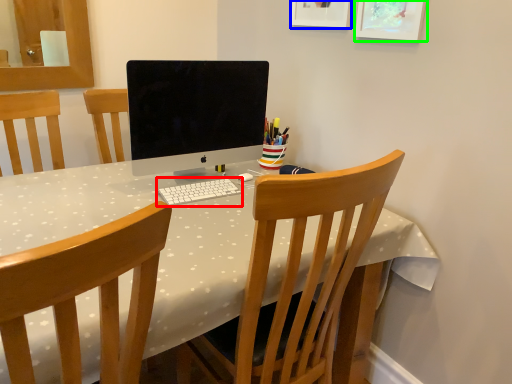
Question: Which is farther away from computer keyboard (highlighted by a red box)? picture frame (highlighted by a blue box) or picture frame (highlighted by a green box)?

Choices:
 (A) picture frame
 (B) picture frame

Answer: (A)